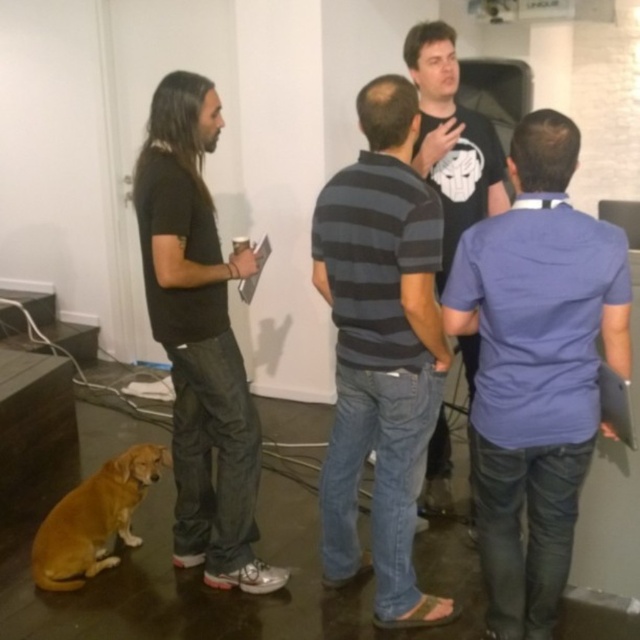
Can you confirm if striped cotton shirt at center is shorter than golden fur dog at lower left?

No, striped cotton shirt at center is not shorter than golden fur dog at lower left.

Between striped cotton shirt at center and golden fur dog at lower left, which one is positioned higher?

striped cotton shirt at center is higher up.

Between point (378, 346) and point (68, 500), which one is positioned in front?

Point (378, 346)

The height and width of the screenshot is (640, 640). What are the coordinates of `striped cotton shirt at center` in the screenshot? It's located at (381, 348).

Is blue cotton shirt at right wider than golden fur dog at lower left?

No.

Between blue cotton shirt at right and golden fur dog at lower left, which one appears on the right side from the viewer's perspective?

blue cotton shirt at right is more to the right.

Does point (528, 486) come closer to viewer compared to point (97, 518)?

Yes, it is.

Where is `blue cotton shirt at right`? The image size is (640, 640). blue cotton shirt at right is located at coordinates (536, 369).

Consider the image. Is striped cotton shirt at center closer to camera compared to black matte t-shirt at center?

Yes, striped cotton shirt at center is closer to the viewer.

Is striped cotton shirt at center below black matte t-shirt at center?

Yes, striped cotton shirt at center is below black matte t-shirt at center.

The height and width of the screenshot is (640, 640). I want to click on striped cotton shirt at center, so click(381, 348).

Identify the location of striped cotton shirt at center. Image resolution: width=640 pixels, height=640 pixels. coord(381,348).